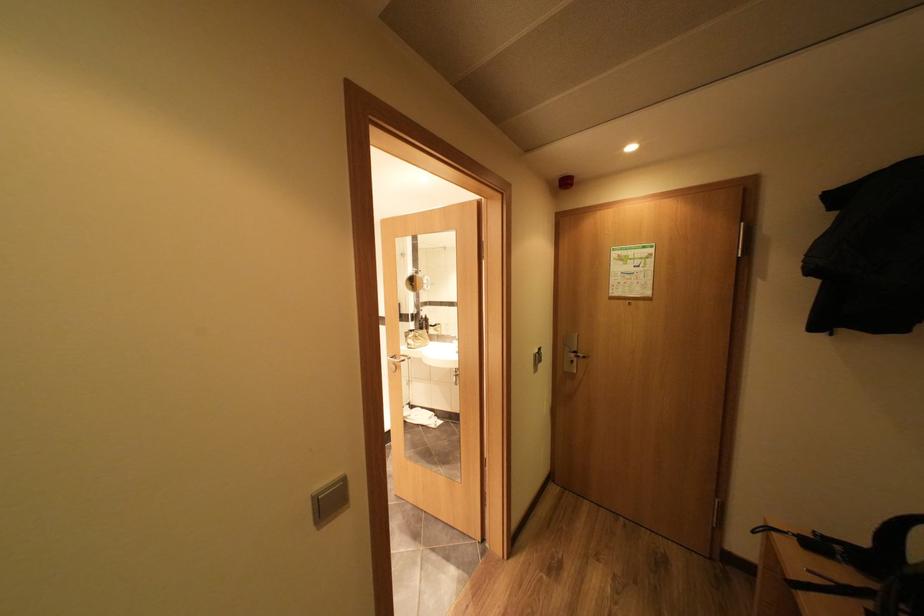
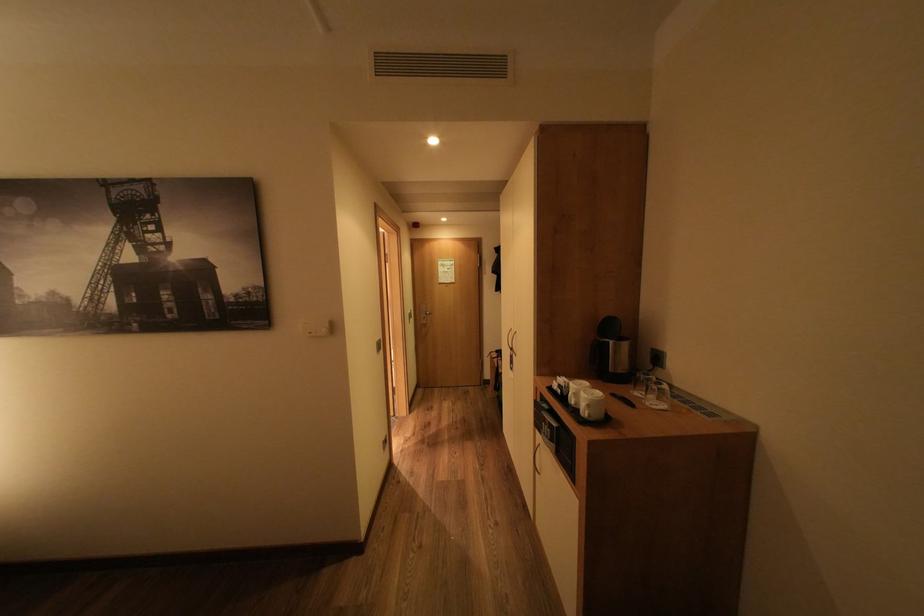
The point at (545, 355) is marked in the first image. Where is the corresponding point in the second image?

(419, 315)